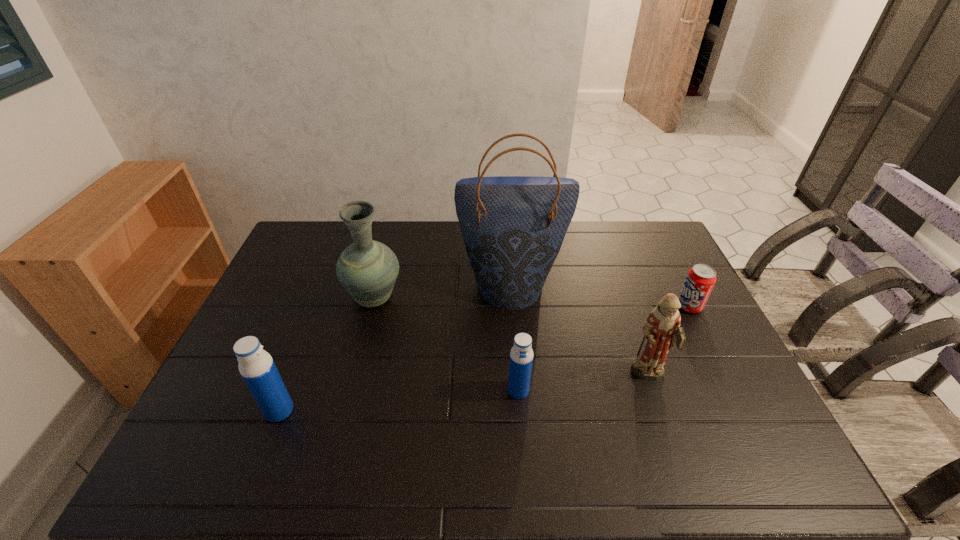
The height and width of the screenshot is (540, 960). What are the coordinates of `free location that satisfies the following two spatial constraints: 1. on the handle side of the shopping bag; 2. on the left side of the second object from left to right` in the screenshot? It's located at (377, 286).

This screenshot has height=540, width=960. Find the location of `blank area in the image that satisfies the following two spatial constraints: 1. on the surface of the rightmost object; 2. on the front-facing side of the figurine`. blank area in the image that satisfies the following two spatial constraints: 1. on the surface of the rightmost object; 2. on the front-facing side of the figurine is located at coordinates (725, 376).